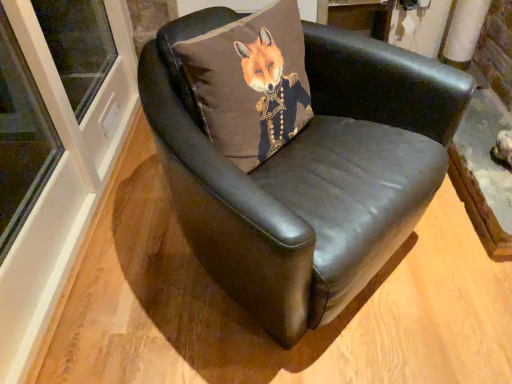
Locate an element on the screen. The height and width of the screenshot is (384, 512). vacant area to the left of black leather chair at center is located at coordinates (122, 261).